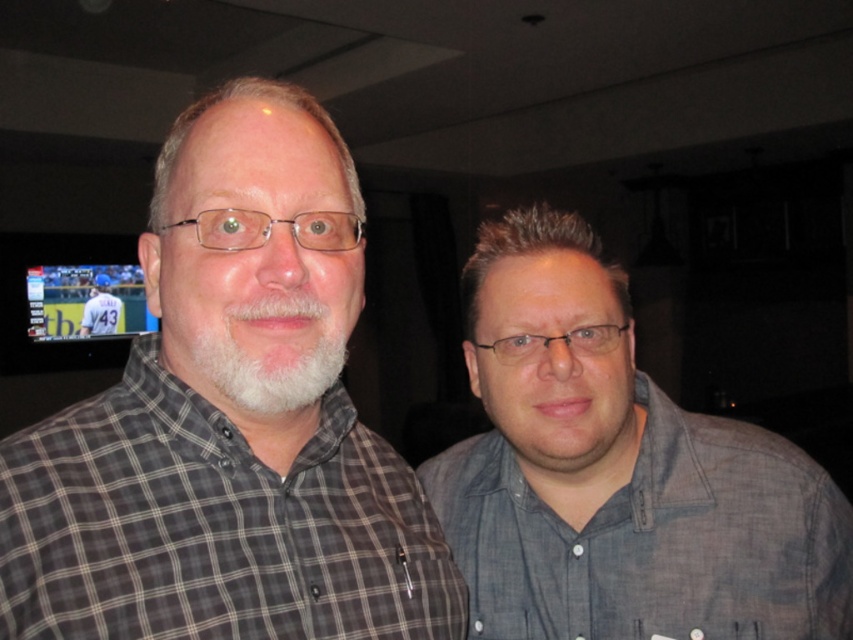
Between gray cotton shirt at right and gray checkered shirt at center, which one is positioned higher?

gray checkered shirt at center

Image resolution: width=853 pixels, height=640 pixels. What do you see at coordinates (653, 538) in the screenshot?
I see `gray cotton shirt at right` at bounding box center [653, 538].

Find the location of a particular element. This screenshot has width=853, height=640. gray cotton shirt at right is located at coordinates (653, 538).

Who is shorter, plaid cotton shirt at left or gray checkered shirt at center?

plaid cotton shirt at left

Is point (0, 557) positioned before point (113, 330)?

That is True.

Which is in front, point (445, 637) or point (107, 289)?

Point (445, 637)

This screenshot has height=640, width=853. Find the location of `plaid cotton shirt at left`. plaid cotton shirt at left is located at coordinates (213, 525).

Does plaid cotton shirt at left have a lesser height compared to gray cotton shirt at right?

Yes, plaid cotton shirt at left is shorter than gray cotton shirt at right.

Does plaid cotton shirt at left appear on the left side of gray cotton shirt at right?

Yes, plaid cotton shirt at left is to the left of gray cotton shirt at right.

Identify the location of plaid cotton shirt at left. point(213,525).